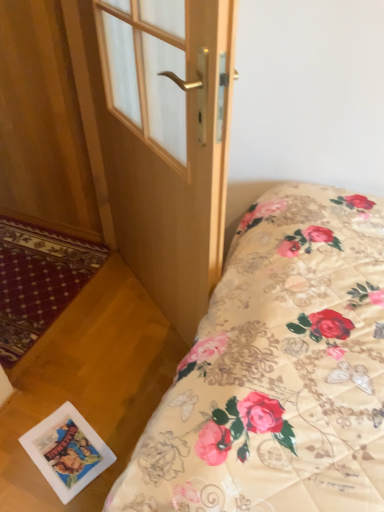
Question: Does wooden door at center lie in front of white glossy postcard at lower left?

Choices:
 (A) yes
 (B) no

Answer: (A)

Question: Is wooden door at center to the right of white glossy postcard at lower left from the viewer's perspective?

Choices:
 (A) yes
 (B) no

Answer: (A)

Question: Is white glossy postcard at lower left located within wooden door at center?

Choices:
 (A) yes
 (B) no

Answer: (B)

Question: Considering the relative sizes of wooden door at center and white glossy postcard at lower left in the image provided, is wooden door at center thinner than white glossy postcard at lower left?

Choices:
 (A) no
 (B) yes

Answer: (B)

Question: Considering the relative positions of wooden door at center and white glossy postcard at lower left in the image provided, is wooden door at center to the left of white glossy postcard at lower left from the viewer's perspective?

Choices:
 (A) no
 (B) yes

Answer: (A)

Question: Is wooden door at center placed right next to white glossy postcard at lower left?

Choices:
 (A) no
 (B) yes

Answer: (A)

Question: Can you confirm if white glossy postcard at lower left is smaller than wooden door at center?

Choices:
 (A) yes
 (B) no

Answer: (A)

Question: Are white glossy postcard at lower left and wooden door at center far apart?

Choices:
 (A) no
 (B) yes

Answer: (A)

Question: From a real-world perspective, is white glossy postcard at lower left located beneath wooden door at center?

Choices:
 (A) no
 (B) yes

Answer: (B)

Question: Can you confirm if white glossy postcard at lower left is positioned to the right of wooden door at center?

Choices:
 (A) no
 (B) yes

Answer: (A)

Question: Considering the relative positions of white glossy postcard at lower left and wooden door at center in the image provided, is white glossy postcard at lower left behind wooden door at center?

Choices:
 (A) yes
 (B) no

Answer: (A)

Question: Does white glossy postcard at lower left have a greater width compared to wooden door at center?

Choices:
 (A) no
 (B) yes

Answer: (B)

Question: From the image's perspective, is wooden door at center above or below white glossy postcard at lower left?

Choices:
 (A) below
 (B) above

Answer: (B)